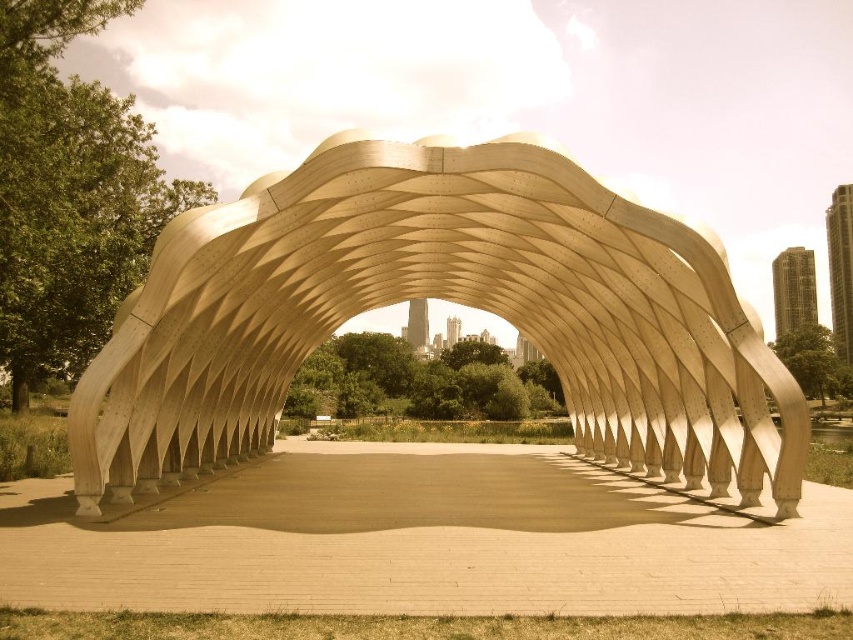
In the scene shown: Does matte wood structure at center appear over smooth concrete path at center?

Correct, matte wood structure at center is located above smooth concrete path at center.

Measure the distance from matte wood structure at center to smooth concrete path at center.

matte wood structure at center is 5.96 meters from smooth concrete path at center.

Does point (366, 221) lie behind point (154, 544)?

That is True.

The width and height of the screenshot is (853, 640). I want to click on matte wood structure at center, so click(440, 298).

Which is more to the left, smooth concrete path at center or metallic glass skyscraper at upper right?

Positioned to the left is smooth concrete path at center.

What do you see at coordinates (424, 540) in the screenshot?
I see `smooth concrete path at center` at bounding box center [424, 540].

Find the location of `smooth concrete path at center`. smooth concrete path at center is located at coordinates (424, 540).

Can you confirm if matte wood structure at center is positioned to the right of metallic glass skyscraper at upper right?

Incorrect, matte wood structure at center is not on the right side of metallic glass skyscraper at upper right.

Where is `matte wood structure at center`? The width and height of the screenshot is (853, 640). matte wood structure at center is located at coordinates (440, 298).